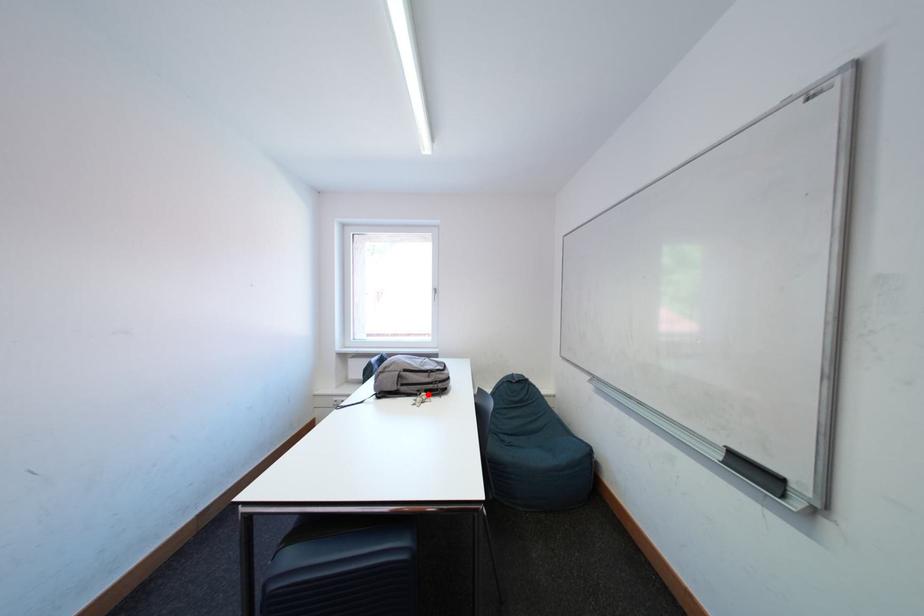
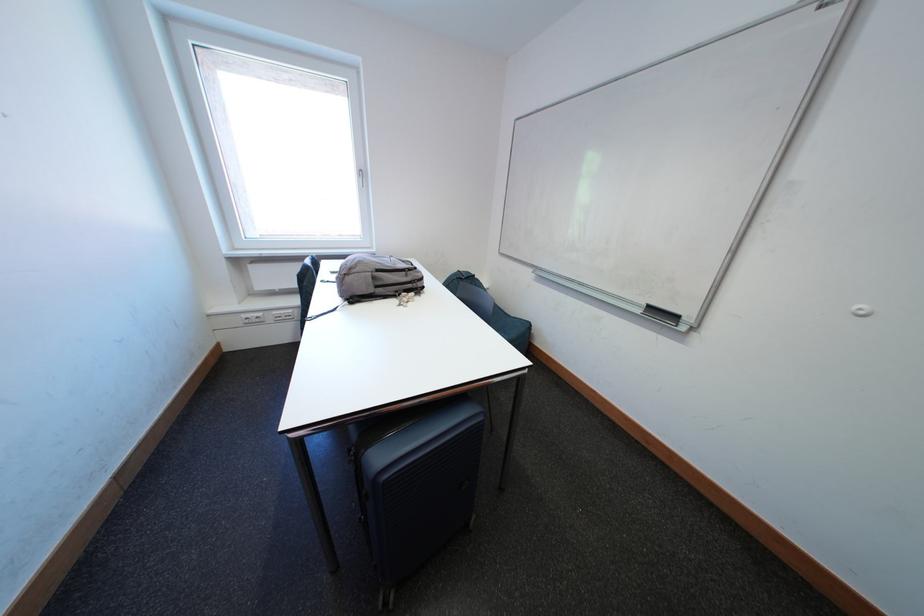
Question: I am providing you with two images of the same scene from different viewpoints. In image1, a red point is highlighted. Considering the same 3D point in image2, which of the following is correct?

Choices:
 (A) It is closer
 (B) It is farther

Answer: (A)